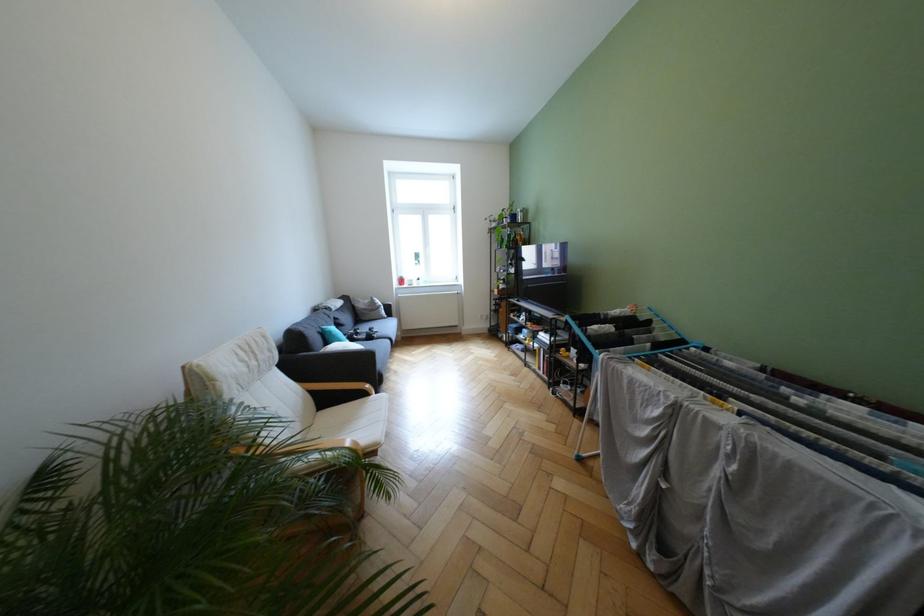
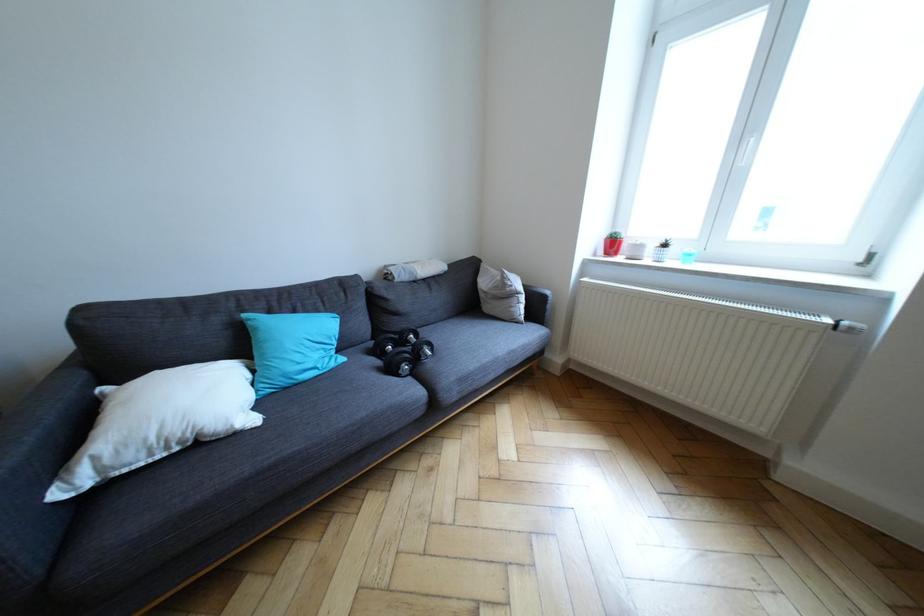
Locate, in the second image, the point that corresponds to pixel 365 338 in the first image.

(399, 347)